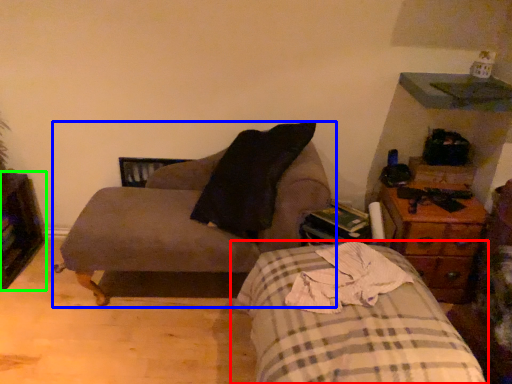
Question: Estimate the real-world distances between objects in this image. Which object is closer to bed (highlighted by a red box), chair (highlighted by a blue box) or dresser (highlighted by a green box)?

Choices:
 (A) chair
 (B) dresser

Answer: (A)